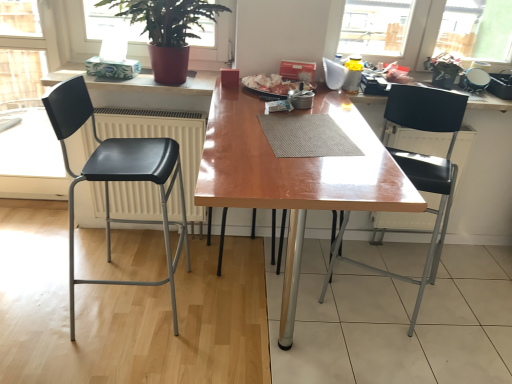
Find the location of a particular element. vacant area located to the right-hand side of wooden table at center is located at coordinates point(450,310).